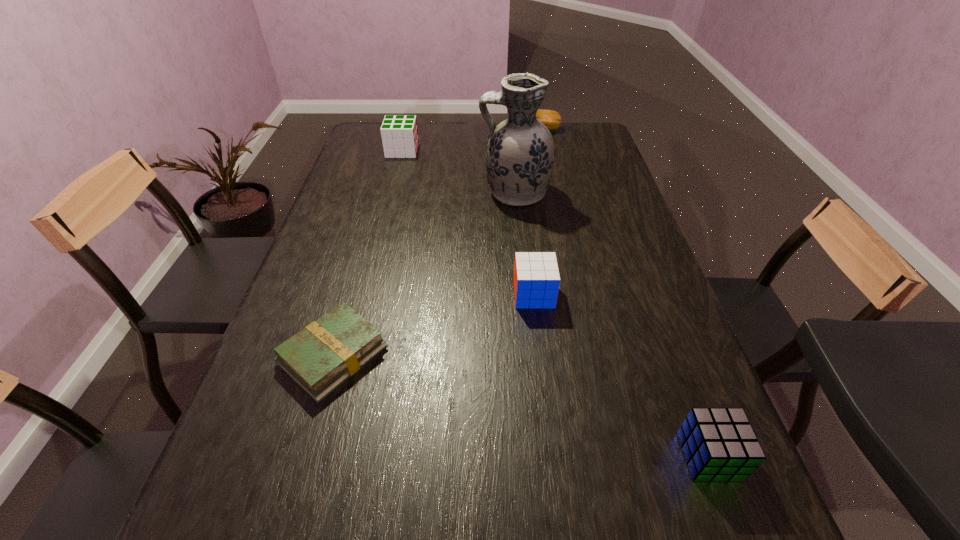
Find the location of a particular element. free space located 0.250m on the right of the fifth farthest object is located at coordinates (504, 354).

You are a GUI agent. You are given a task and a screenshot of the screen. Output one action in this format:
    pyautogui.click(x=<x>, y=<y>)
    Task: Click on the cube that is at the far edge
    The height and width of the screenshot is (540, 960).
    Given the screenshot: What is the action you would take?
    pyautogui.click(x=399, y=133)

Identify the location of gourd present at the far edge. The width and height of the screenshot is (960, 540). (551, 119).

In order to click on cube positioned at the left edge in this screenshot , I will do `click(399, 133)`.

The height and width of the screenshot is (540, 960). I want to click on book at the left edge, so click(x=319, y=358).

The width and height of the screenshot is (960, 540). I want to click on gourd located in the right edge section of the desktop, so click(551, 119).

The image size is (960, 540). I want to click on cube at the right edge, so click(719, 444).

Identify the location of object that is at the far left corner. (399, 133).

Find the location of a particular element. This screenshot has width=960, height=540. object that is positioned at the far right corner is located at coordinates (551, 119).

Where is `free space at the far edge of the desktop`? free space at the far edge of the desktop is located at coordinates (465, 130).